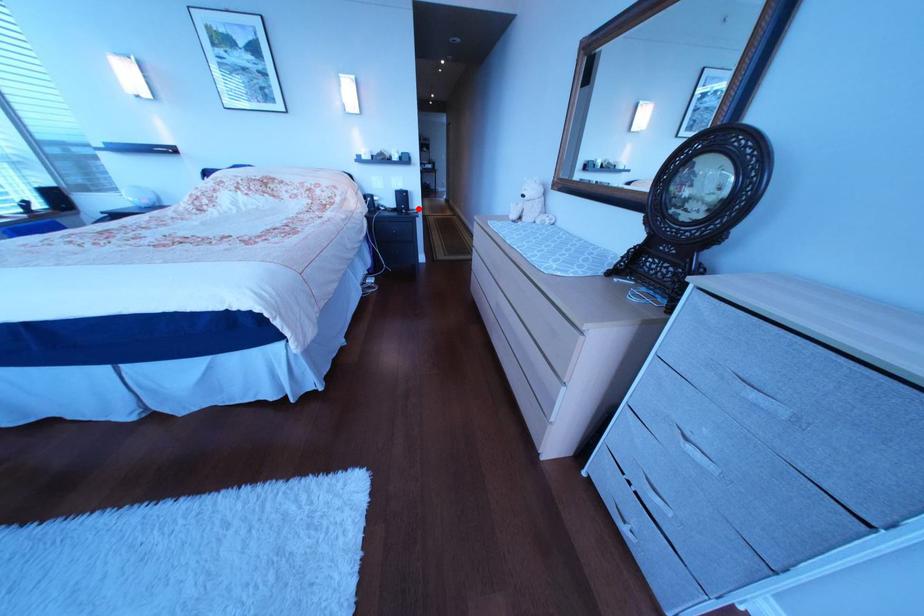
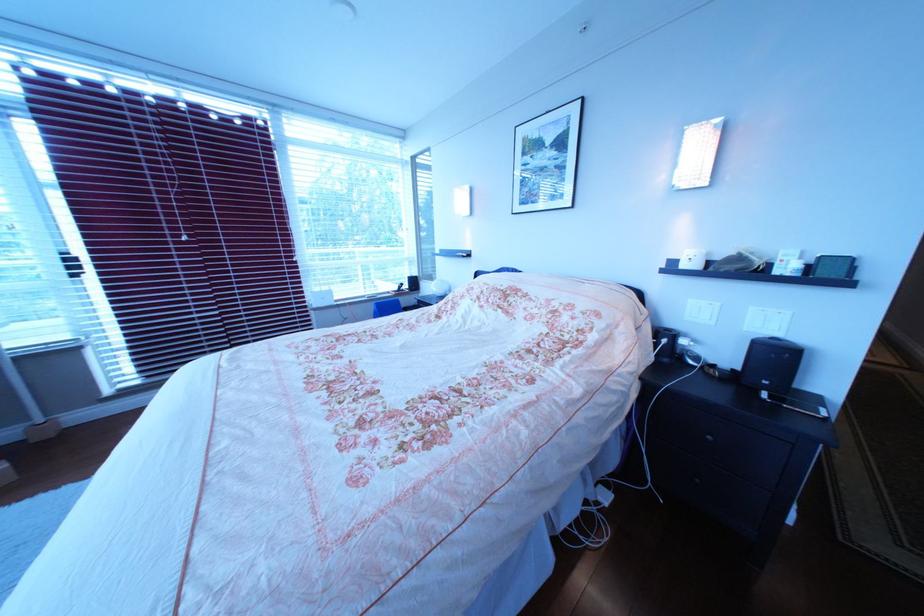
Question: I am providing you with two images of the same scene from different viewpoints. In image1, a red point is highlighted. Considering the same 3D point in image2, which of the following is correct?

Choices:
 (A) It is closer
 (B) It is farther

Answer: (B)